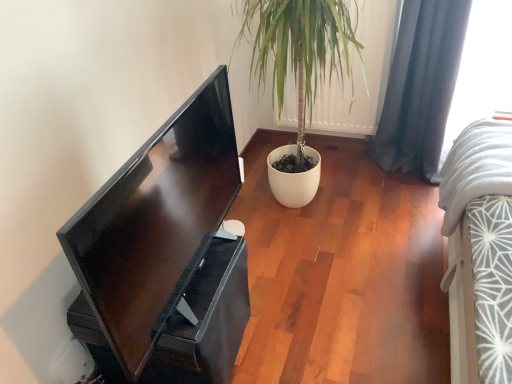
Question: Is dark blue fabric curtain at right touching white fabric at upper right?

Choices:
 (A) no
 (B) yes

Answer: (A)

Question: Is dark blue fabric curtain at right wider than white fabric at upper right?

Choices:
 (A) yes
 (B) no

Answer: (B)

Question: Is dark blue fabric curtain at right smaller than white fabric at upper right?

Choices:
 (A) no
 (B) yes

Answer: (B)

Question: Can you confirm if dark blue fabric curtain at right is shorter than white fabric at upper right?

Choices:
 (A) no
 (B) yes

Answer: (A)

Question: From a real-world perspective, is dark blue fabric curtain at right on white fabric at upper right?

Choices:
 (A) yes
 (B) no

Answer: (A)

Question: Is there a large distance between dark blue fabric curtain at right and white fabric at upper right?

Choices:
 (A) no
 (B) yes

Answer: (A)

Question: From a real-world perspective, is dark blue fabric curtain at right positioned over matte black monitor at left based on gravity?

Choices:
 (A) yes
 (B) no

Answer: (B)

Question: Could you tell me if dark blue fabric curtain at right is facing matte black monitor at left?

Choices:
 (A) yes
 (B) no

Answer: (B)

Question: Is dark blue fabric curtain at right closer to the viewer compared to matte black monitor at left?

Choices:
 (A) no
 (B) yes

Answer: (A)

Question: Is dark blue fabric curtain at right looking in the opposite direction of matte black monitor at left?

Choices:
 (A) yes
 (B) no

Answer: (B)

Question: Considering the relative positions of dark blue fabric curtain at right and matte black monitor at left in the image provided, is dark blue fabric curtain at right to the left of matte black monitor at left from the viewer's perspective?

Choices:
 (A) no
 (B) yes

Answer: (A)

Question: Can you confirm if dark blue fabric curtain at right is thinner than matte black monitor at left?

Choices:
 (A) no
 (B) yes

Answer: (A)

Question: Is there a large distance between matte black monitor at left and white fabric at upper right?

Choices:
 (A) no
 (B) yes

Answer: (B)